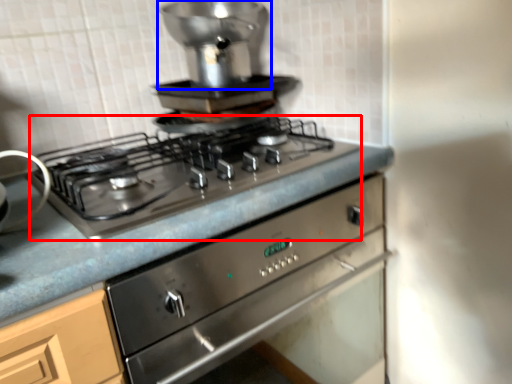
Question: Among these objects, which one is nearest to the camera, gas stove (highlighted by a red box) or appliance (highlighted by a blue box)?

Choices:
 (A) gas stove
 (B) appliance

Answer: (A)